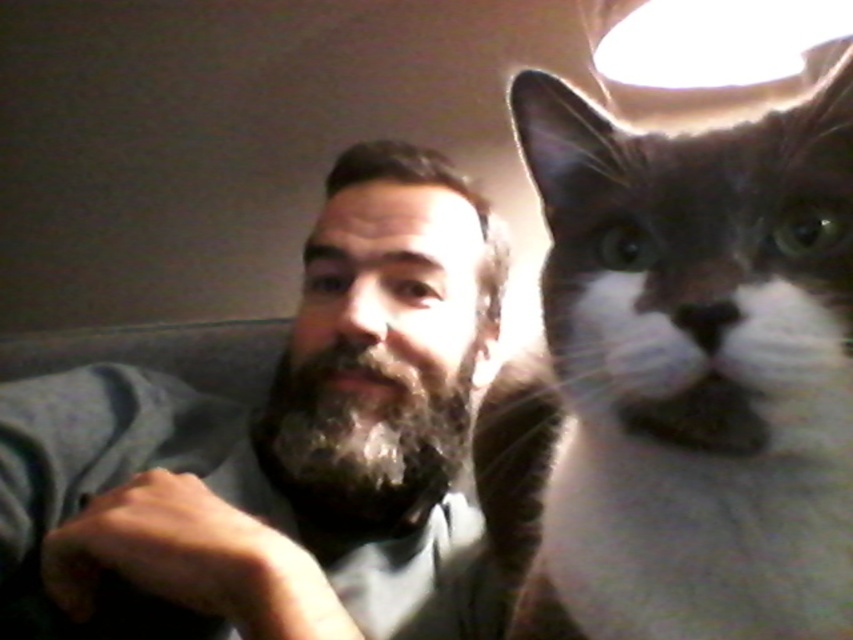
Question: Observing the image, what is the correct spatial positioning of gray-white fur cat at right in reference to bearded man at left?

Choices:
 (A) above
 (B) below

Answer: (A)

Question: Can you confirm if gray-white fur cat at right is bigger than bearded man at left?

Choices:
 (A) no
 (B) yes

Answer: (A)

Question: Which of the following is the closest to the observer?

Choices:
 (A) bearded man at left
 (B) gray-white fur cat at right

Answer: (B)

Question: Is gray-white fur cat at right positioned at the back of bearded man at left?

Choices:
 (A) no
 (B) yes

Answer: (A)

Question: Which point appears farthest from the camera in this image?

Choices:
 (A) (71, 486)
 (B) (704, 404)

Answer: (A)